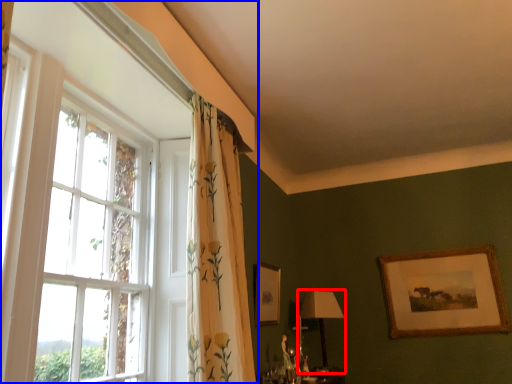
Question: Which point is closer to the camera, table lamp (highlighted by a red box) or window (highlighted by a blue box)?

Choices:
 (A) table lamp
 (B) window

Answer: (B)